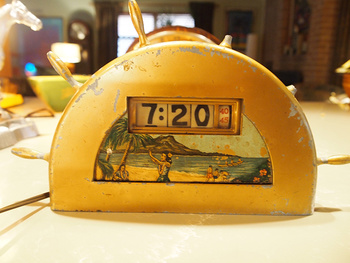
Locate an element on the screen. The width and height of the screenshot is (350, 263). lamp is located at coordinates (67, 50).